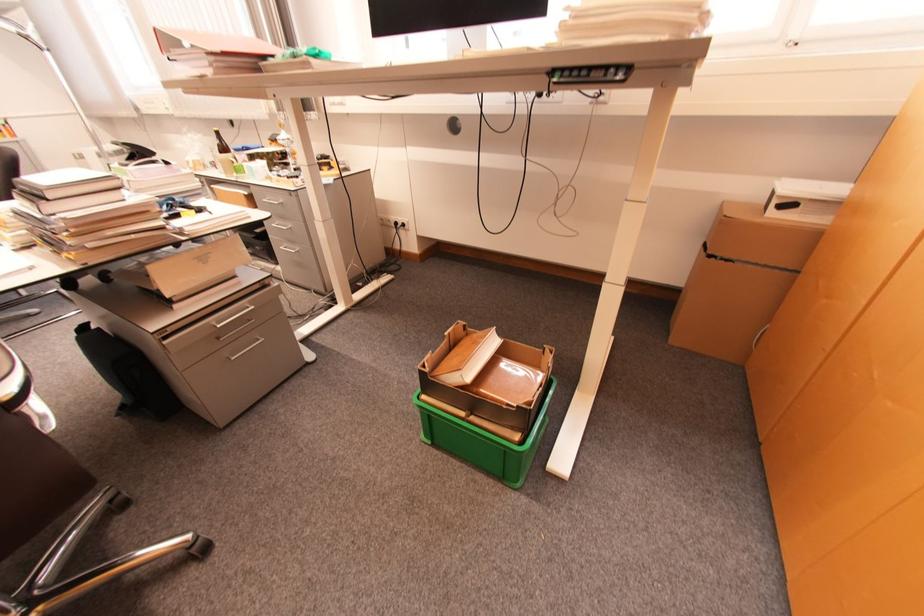
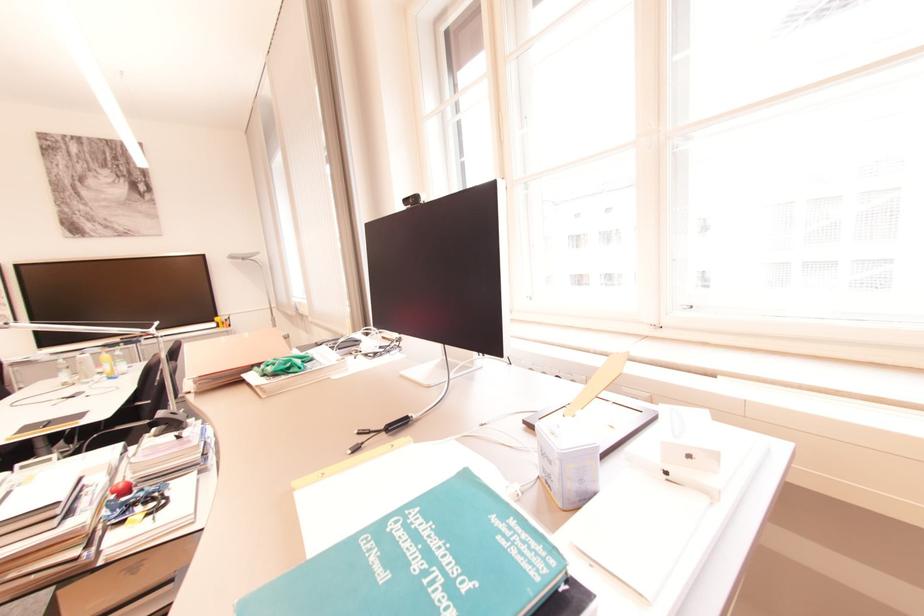
The first image is from the beginning of the video and the second image is from the end. How did the camera likely rotate when shooting the video?

The camera's rotation is toward left-up.